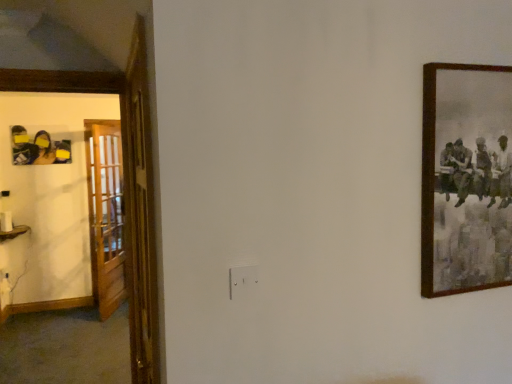
Question: Do you think wooden picture frame at right is within matte black photo frame at left, or outside of it?

Choices:
 (A) inside
 (B) outside

Answer: (B)

Question: In the image, is wooden picture frame at right positioned in front of or behind matte black photo frame at left?

Choices:
 (A) behind
 (B) front

Answer: (B)

Question: Which is nearer to the wooden at left, the 1th door positioned from the back?

Choices:
 (A) matte black photo frame at left
 (B) wooden picture frame at right
 (C) wooden door at left, marked as the second door in a back-to-front arrangement

Answer: (A)

Question: Which object is positioned closest to the wooden at left, the first door positioned from the left?

Choices:
 (A) matte black photo frame at left
 (B) wooden picture frame at right
 (C) wooden door at left, placed as the 1th door when sorted from front to back

Answer: (A)